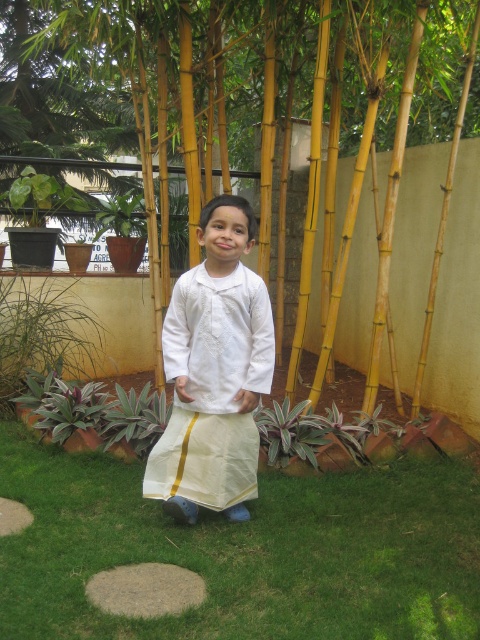
The young boy is standing on the green grass at center and looking towards the yellow bamboo forest at center. Which object is smaller in size between the two?

The green grass at center is smaller in size compared to the yellow bamboo forest at center.

You are a gardener who needs to plant a new flower that requires direct sunlight. You have two areas to choose from in the garden scene described. Which area would be better for planting the flowers, the green grass at center or the yellow bamboo forest at center?

Answer: The green grass at center would be better for planting the flowers since it is not as tall as the yellow bamboo forest at center, allowing more sunlight to reach the flowers.